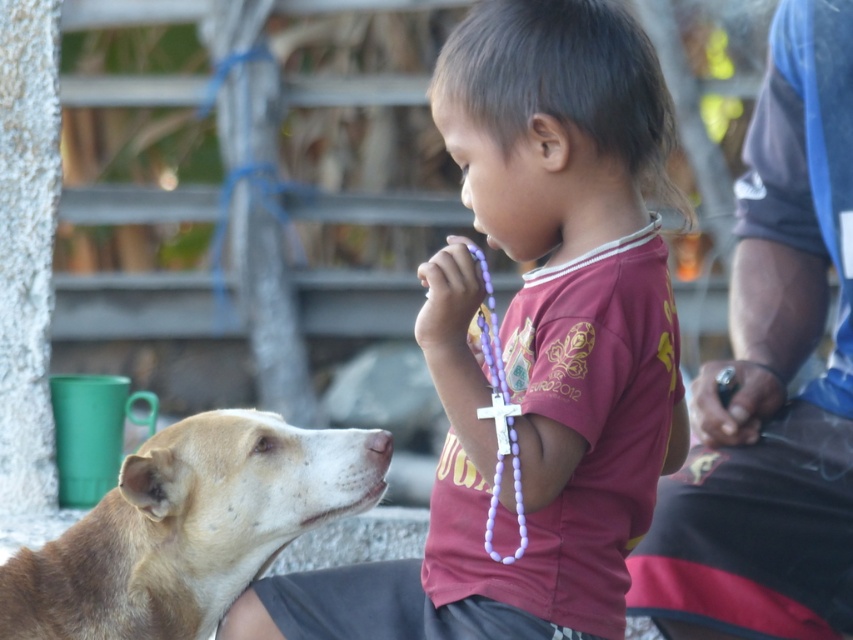
Is point (554, 451) more distant than point (195, 419)?

No, it is in front of (195, 419).

Based on the photo, between purple plastic rosary at center and brown furry dog at lower left, which one appears on the right side from the viewer's perspective?

Positioned to the right is purple plastic rosary at center.

Locate an element on the screen. This screenshot has width=853, height=640. purple plastic rosary at center is located at coordinates (532, 342).